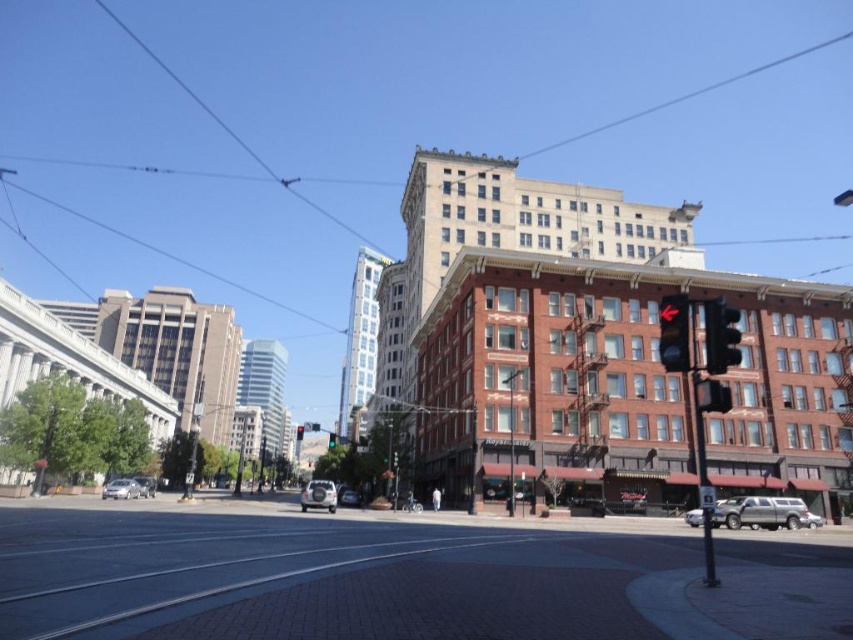
You are a pedestrian standing at the intersection and want to cross the street. There is a metallic traffic light at center right and a silver metallic suv at center. Which object is taller and could potentially block your view of oncoming traffic?

The metallic traffic light at center right is taller than the silver metallic suv at center, so it could potentially block your view of oncoming traffic.

You are a delivery person needing to park your 2.5 meters wide truck between the silver metallic car at center and the silver metallic car at lower left. Can you fit your truck in that space?

The silver metallic car at center might be wider than silver metallic car at lower left, so the space between them may not be wide enough for your 2.5 meters wide truck. You should check the exact width before attempting to park.